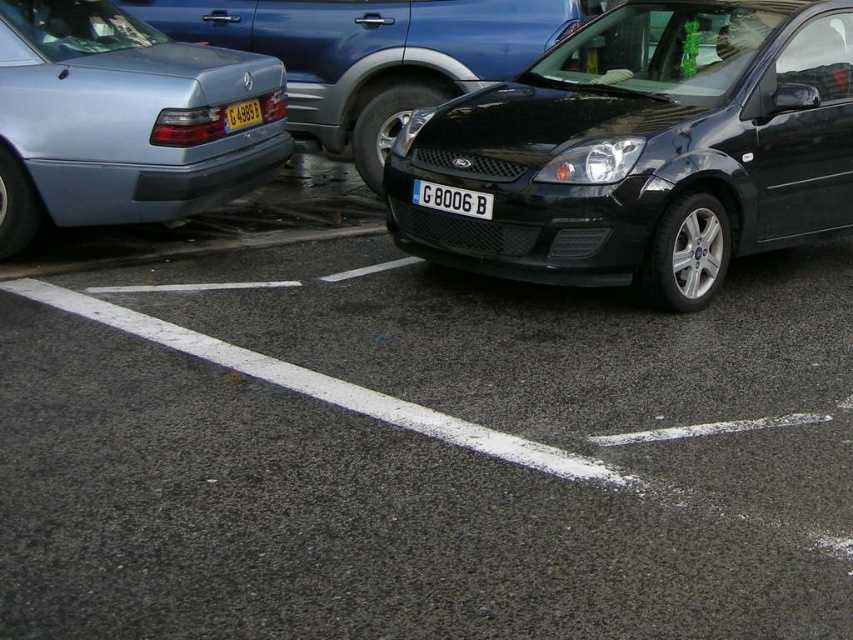
Does black plastic license plate at center have a greater height compared to yellow matte license plate at center?

In fact, black plastic license plate at center may be shorter than yellow matte license plate at center.

The image size is (853, 640). Describe the element at coordinates (451, 198) in the screenshot. I see `black plastic license plate at center` at that location.

You are a GUI agent. You are given a task and a screenshot of the screen. Output one action in this format:
    pyautogui.click(x=<x>, y=<y>)
    Task: Click on the black plastic license plate at center
    The image size is (853, 640).
    Given the screenshot: What is the action you would take?
    pyautogui.click(x=451, y=198)

Between point (616, 26) and point (61, 131), which one is positioned behind?

The point (616, 26) is more distant.

Identify the location of black glossy car at center. (643, 148).

Which is in front, point (534, 209) or point (287, 156)?

Point (534, 209) is in front.

This screenshot has height=640, width=853. I want to click on black glossy car at center, so click(x=643, y=148).

Between point (825, 45) and point (488, 205), which one is positioned behind?

The point (825, 45) is behind.

You are a GUI agent. You are given a task and a screenshot of the screen. Output one action in this format:
    pyautogui.click(x=<x>, y=<y>)
    Task: Click on the black glossy car at center
    
    Given the screenshot: What is the action you would take?
    pyautogui.click(x=643, y=148)